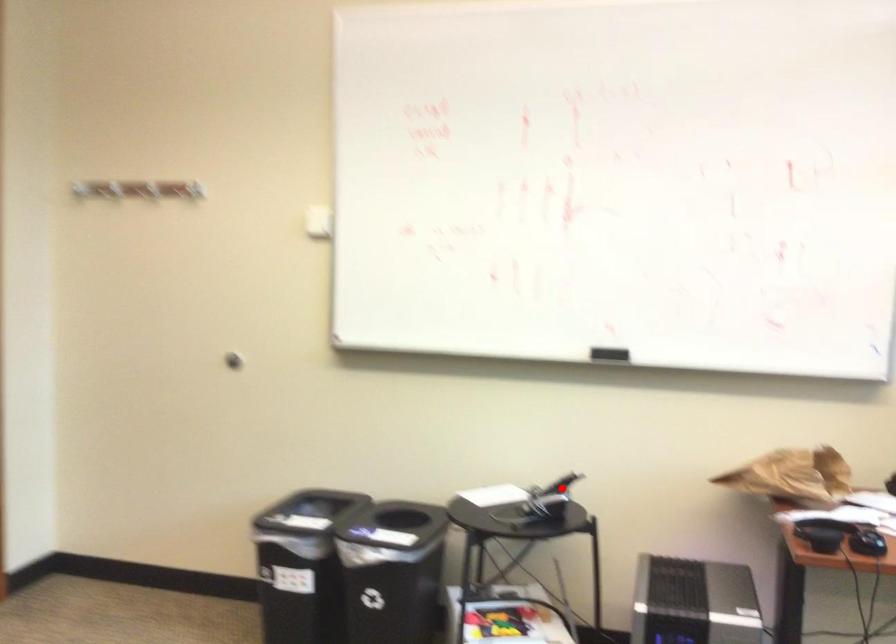
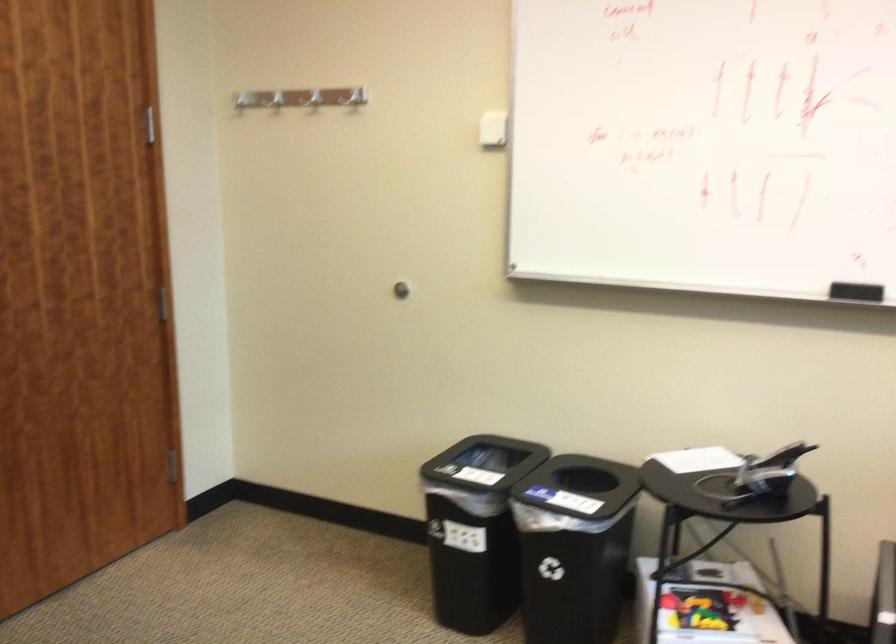
Question: I am providing you with two images of the same scene from different viewpoints. Given a red point in image1, look at the same physical point in image2. Is it:

Choices:
 (A) Closer to the viewpoint
 (B) Farther from the viewpoint

Answer: (A)